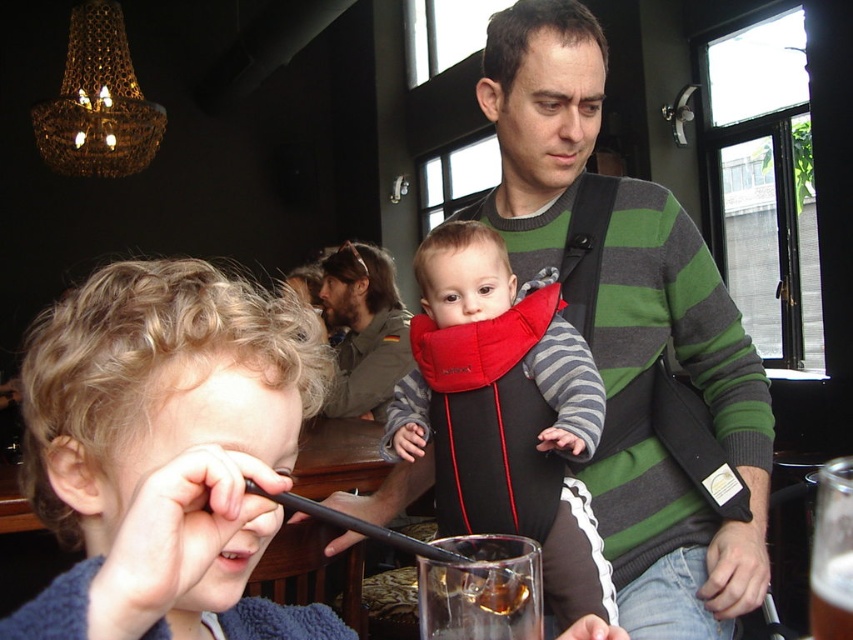
Question: Which is nearer to the striped fabric baby carrier at center?

Choices:
 (A) translucent amber liquid at lower center
 (B) dark brown leather jacket at upper center
 (C) green striped sweater at center

Answer: (C)

Question: Can you confirm if curly blonde hair at center is thinner than translucent glass beverage at lower right?

Choices:
 (A) no
 (B) yes

Answer: (A)

Question: Which point appears closest to the camera in this image?

Choices:
 (A) click(90, 353)
 (B) click(527, 307)
 (C) click(447, 593)
 (D) click(607, 433)

Answer: (A)

Question: Is striped fabric baby carrier at center bigger than translucent glass beverage at lower right?

Choices:
 (A) no
 (B) yes

Answer: (B)

Question: Does green striped sweater at center appear on the left side of curly blonde hair at center?

Choices:
 (A) no
 (B) yes

Answer: (A)

Question: Which object is positioned closest to the translucent amber liquid at lower center?

Choices:
 (A) dark brown leather jacket at upper center
 (B) green striped sweater at center
 (C) curly blonde hair at center

Answer: (C)